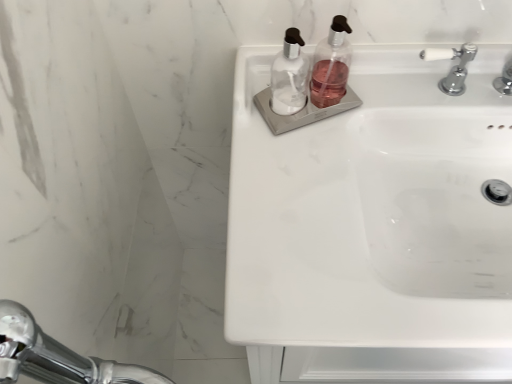
Where is `free space between transparent plastic soap dispenser at center, which is the 1th soap dispenser from left to right, and white ceramic tap at upper right`? The image size is (512, 384). free space between transparent plastic soap dispenser at center, which is the 1th soap dispenser from left to right, and white ceramic tap at upper right is located at coordinates tap(373, 103).